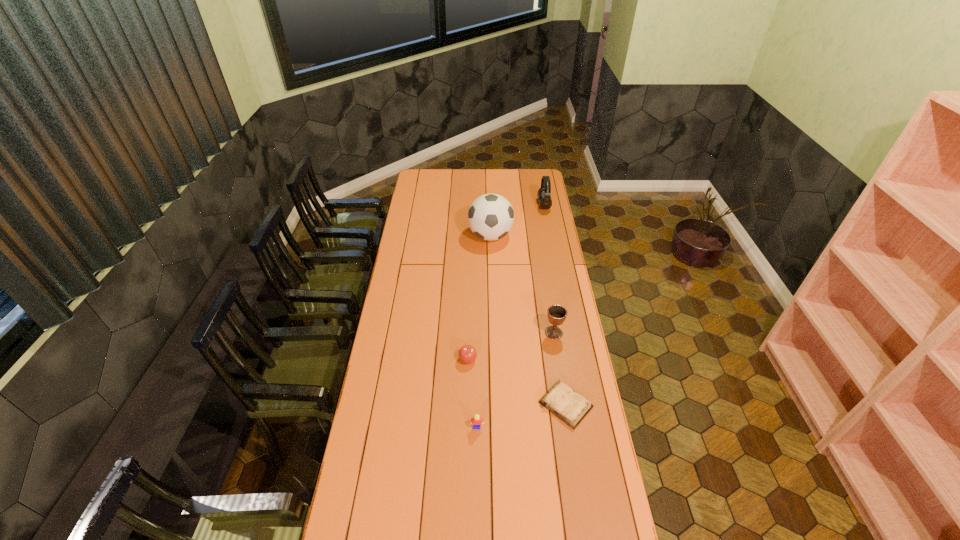
Where is `soccer ball`? The width and height of the screenshot is (960, 540). soccer ball is located at coordinates (491, 216).

This screenshot has height=540, width=960. What are the coordinates of `the tallest object` in the screenshot? It's located at (491, 216).

Where is `the fifth shortest object`? This screenshot has width=960, height=540. the fifth shortest object is located at coordinates (544, 193).

Locate an element on the screen. This screenshot has width=960, height=540. the farthest object is located at coordinates (544, 193).

Find the location of a particular element. Image resolution: width=960 pixels, height=540 pixels. chalice is located at coordinates (556, 314).

Locate an element on the screen. This screenshot has width=960, height=540. the fourth nearest object is located at coordinates (556, 314).

This screenshot has width=960, height=540. I want to click on apple, so click(467, 353).

The image size is (960, 540). Find the location of `Lego`. Lego is located at coordinates (476, 420).

In order to click on diary in this screenshot , I will do `click(571, 407)`.

This screenshot has width=960, height=540. In order to click on free spot located on the left of the soccer ball in this screenshot , I will do `click(407, 236)`.